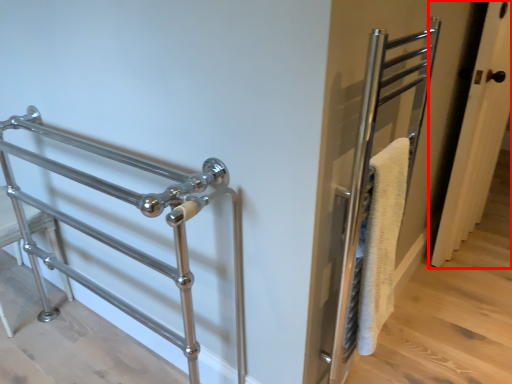
Question: Where is door (annotated by the red box) located in relation to steel in the image?

Choices:
 (A) right
 (B) left

Answer: (A)